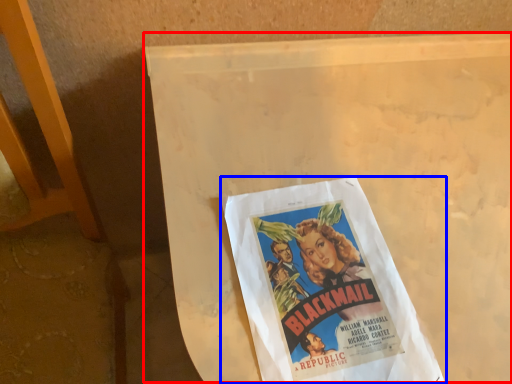
Question: Which object appears farthest to the camera in this image, table (highlighted by a red box) or poster (highlighted by a blue box)?

Choices:
 (A) table
 (B) poster

Answer: (B)